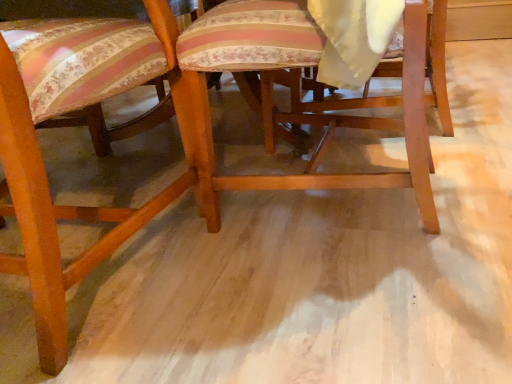
Question: From the image's perspective, relative to wooden chair at center, marked as the first chair in a right-to-left arrangement, is wooden chair at center, the second chair when ordered from right to left, above or below?

Choices:
 (A) below
 (B) above

Answer: (A)

Question: Considering the positions of wooden chair at center, the second chair when ordered from right to left, and wooden chair at center, marked as the first chair in a right-to-left arrangement, in the image, is wooden chair at center, the second chair when ordered from right to left, wider or thinner than wooden chair at center, marked as the first chair in a right-to-left arrangement,?

Choices:
 (A) wide
 (B) thin

Answer: (A)

Question: Considering the positions of wooden chair at center, the second chair when ordered from right to left, and wooden chair at center, marked as the first chair in a right-to-left arrangement, in the image, is wooden chair at center, the second chair when ordered from right to left, bigger or smaller than wooden chair at center, marked as the first chair in a right-to-left arrangement,?

Choices:
 (A) big
 (B) small

Answer: (A)

Question: Is wooden chair at center, marked as the first chair in a right-to-left arrangement, bigger or smaller than wooden chair at center, the second chair when ordered from right to left?

Choices:
 (A) small
 (B) big

Answer: (A)

Question: Considering their positions, is wooden chair at center, the second chair positioned from the left, located in front of or behind wooden chair at center, the second chair when ordered from right to left?

Choices:
 (A) front
 (B) behind

Answer: (B)

Question: From a real-world perspective, is wooden chair at center, the second chair positioned from the left, above or below wooden chair at center, arranged as the first chair when viewed from the left?

Choices:
 (A) below
 (B) above

Answer: (A)

Question: Is point (211, 221) closer or farther from the camera than point (4, 122)?

Choices:
 (A) closer
 (B) farther

Answer: (B)